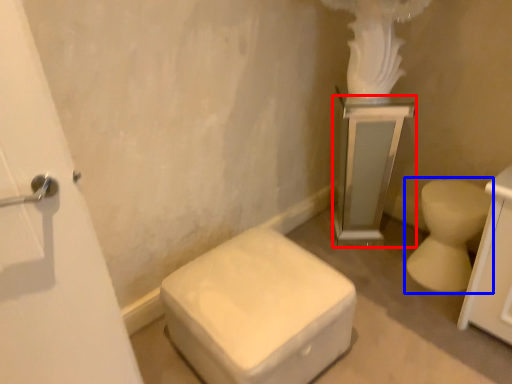
Question: Among these objects, which one is nearest to the camera, medicine cabinet (highlighted by a red box) or toilet (highlighted by a blue box)?

Choices:
 (A) medicine cabinet
 (B) toilet

Answer: (B)